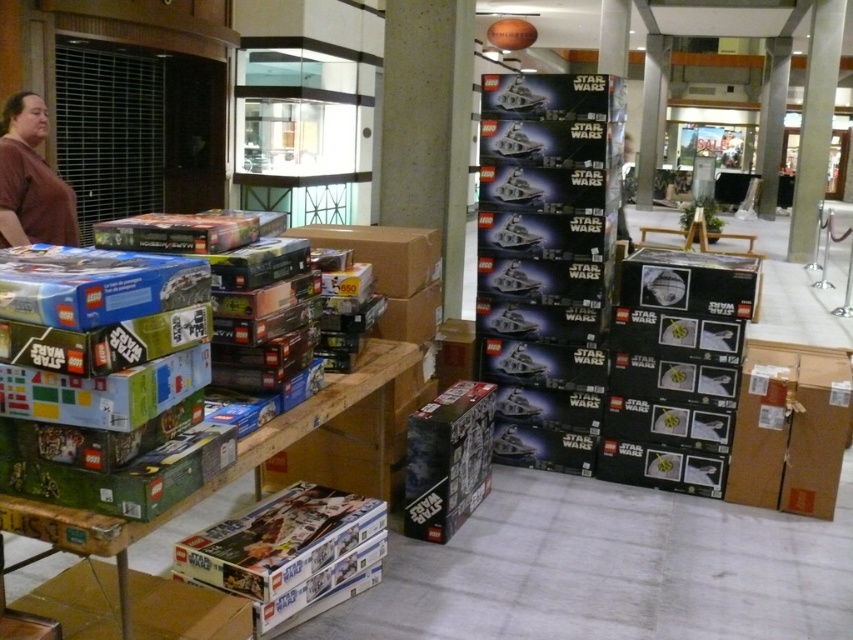
Question: Is brown cardboard box at lower right positioned in front of brown matte shirt at left?

Choices:
 (A) no
 (B) yes

Answer: (B)

Question: Which of the following is the closest to the observer?

Choices:
 (A) brown cardboard box at lower right
 (B) brown matte shirt at left

Answer: (A)

Question: Which point is farther to the camera?

Choices:
 (A) (798, 477)
 (B) (28, 225)

Answer: (B)

Question: Is brown cardboard box at lower right positioned in front of brown matte shirt at left?

Choices:
 (A) no
 (B) yes

Answer: (B)

Question: Does brown cardboard box at lower right appear under brown matte shirt at left?

Choices:
 (A) yes
 (B) no

Answer: (A)